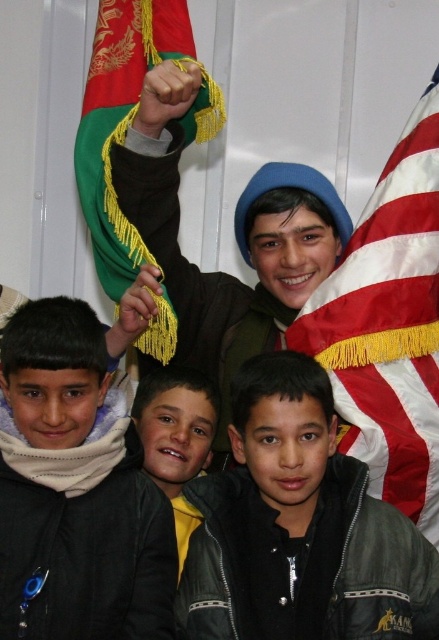
Question: Which object is the farthest from the dark green jacket at lower right?

Choices:
 (A) black fleece jacket at lower left
 (B) american flag at right
 (C) yellow fleece jacket at center
 (D) green fabric flag at upper left

Answer: (D)

Question: Which of these objects is positioned farthest from the green fabric flag at upper left?

Choices:
 (A) yellow fleece jacket at center
 (B) dark green jacket at lower right
 (C) american flag at right

Answer: (B)

Question: Is dark green jacket at lower right thinner than american flag at right?

Choices:
 (A) yes
 (B) no

Answer: (B)

Question: Is dark green jacket at lower right bigger than american flag at right?

Choices:
 (A) no
 (B) yes

Answer: (A)

Question: Which of these objects is positioned farthest from the black fleece jacket at lower left?

Choices:
 (A) american flag at right
 (B) green fabric flag at upper left
 (C) yellow fleece jacket at center
 (D) dark green jacket at lower right

Answer: (A)

Question: Is dark green jacket at lower right closer to camera compared to green fabric flag at upper left?

Choices:
 (A) yes
 (B) no

Answer: (A)